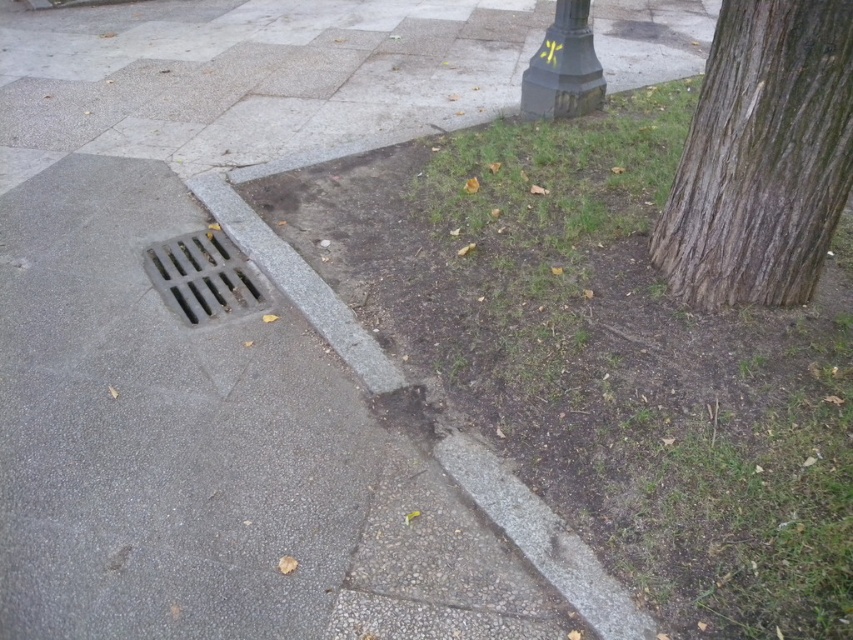
You are standing at the point marked as point (799, 188) on the sidewalk. The lamppost in the upper right corner is 3 meters tall. Can you see the top of the lamppost from your current position?

The point (799, 188) is 2.41 meters from the viewer. Since the lamppost is 3 meters tall, and the point is only 2.41 meters away, the top of the lamppost would be visible as it extends above the viewer.

You are a painter standing on the sidewalk near the brown rough bark at right and the dark green textured pole at upper right. Which object should you look up to see the top of?

The brown rough bark at right is taller than the dark green textured pole at upper right, so you should look up at the brown rough bark at right to see its top.

You are standing at point (202, 276) on the sidewalk. What object is directly beneath your feet?

The metallic grate at lower left is located at point (202, 276), so the object directly beneath your feet is the metallic grate at lower left.